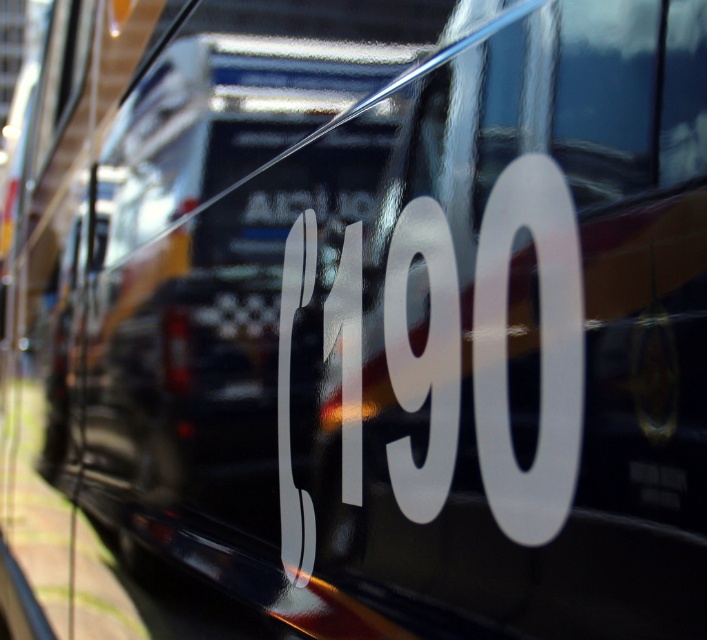
You are standing 3 feet away from a glossy black number at center. Can you read the number clearly?

The glossy black number at center and viewer are 3.38 feet apart from each other, so yes, you can read the number clearly since you are within the comfortable reading distance.

What is the exact coordinate of the glossy black number at center?

The glossy black number at center is located at point (216, 252).

You are a passenger on a bus and you see the glossy black number at center and the white glossy number at center reflected in the window. Which number is more to the left in the reflection?

The glossy black number at center is positioned on the left side of white glossy number at center, so the glossy black number at center is more to the left in the reflection.